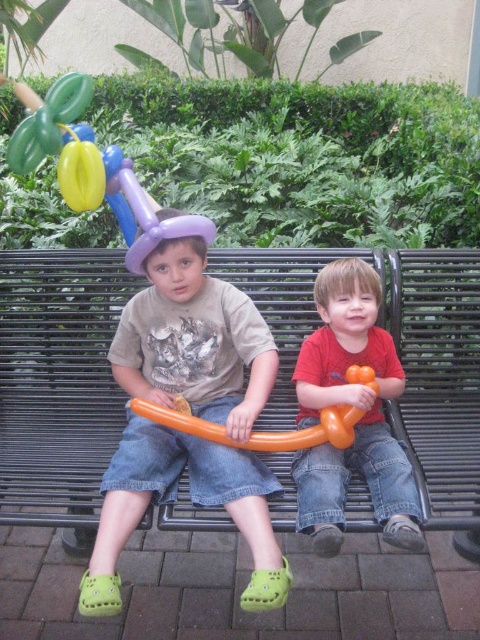
Is orange rubber balloon at center behind yellow rubber balloon at upper left?

No, orange rubber balloon at center is closer to the viewer.

Which is in front, point (333, 410) or point (97, 188)?

Point (97, 188) is more forward.

Find the location of a particular element. Image resolution: width=480 pixels, height=640 pixels. orange rubber balloon at center is located at coordinates (262, 432).

Does black metal bench at center have a larger size compared to orange rubber balloon at center?

Yes.

How much distance is there between black metal bench at center and orange rubber balloon at center?

A distance of 12.25 inches exists between black metal bench at center and orange rubber balloon at center.

Find the location of `black metal bench at center`. black metal bench at center is located at coordinates pyautogui.click(x=397, y=353).

Does black metal bench at center have a greater height compared to matte orange balloon animal at center?

Yes, black metal bench at center is taller than matte orange balloon animal at center.

Consider the image. Which is below, black metal bench at center or matte orange balloon animal at center?

matte orange balloon animal at center is lower down.

Is point (73, 483) positioned behind point (314, 412)?

No, it is in front of (314, 412).

At what (x,y) coordinates should I click in order to perform the action: click on black metal bench at center. Please return your answer as a coordinate pair (x, y). The image size is (480, 640). Looking at the image, I should click on (397, 353).